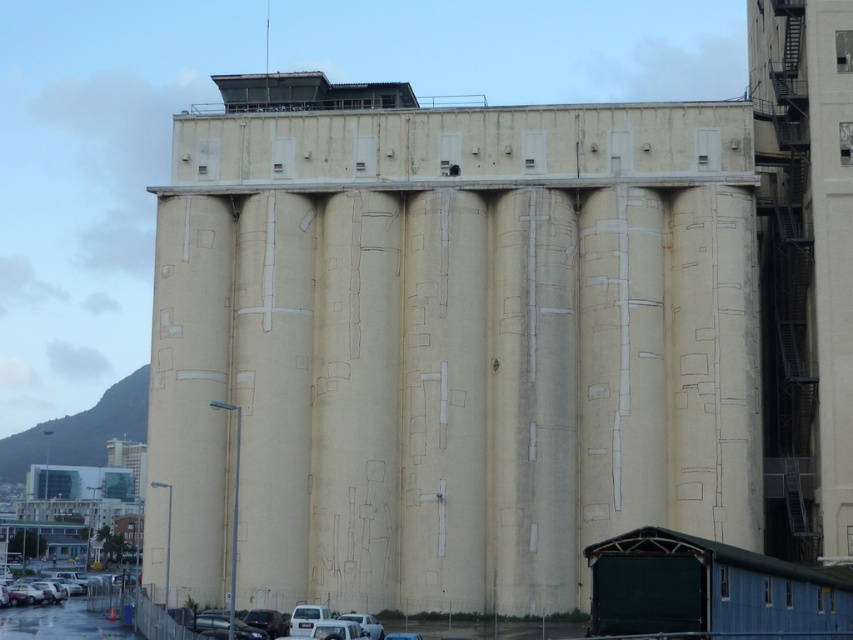
Based on the photo, between beige concrete silo at center and silver metallic car at lower left, which one has less height?

silver metallic car at lower left

Can you confirm if beige concrete silo at center is smaller than silver metallic car at lower left?

Incorrect, beige concrete silo at center is not smaller in size than silver metallic car at lower left.

This screenshot has width=853, height=640. In order to click on beige concrete silo at center in this screenshot , I will do `click(447, 342)`.